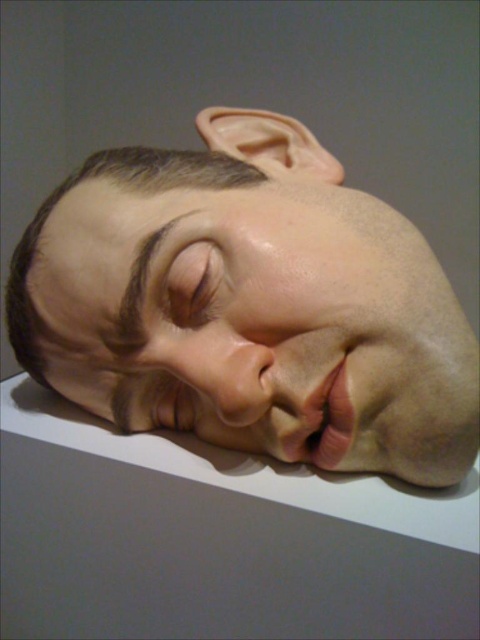
You are an art student analyzing the sculpture. You notice a specific point at coordinates (x=251, y=307). Based on the sculpture description, what part of the sculpture does this point likely represent?

The point at coordinates (x=251, y=307) corresponds to the smooth skin head at center.

You are an art conservator examining the sculpture. You need to place a protective cover over the smooth skin head at center. Where exactly should you position the cover to ensure it covers the sculpture properly?

The smooth skin head at center is located at point coordinates of (251,307). Position the cover precisely at this point to ensure proper coverage.